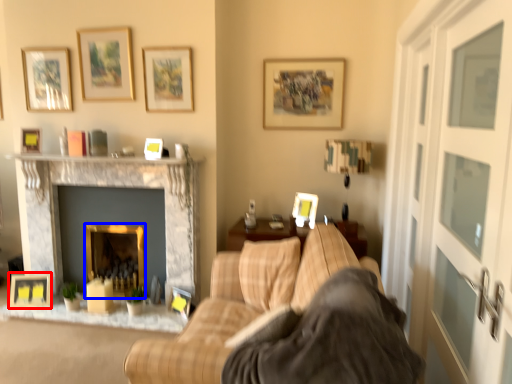
Question: Which object appears closest to the camera in this image, picture frame (highlighted by a red box) or fireplace (highlighted by a blue box)?

Choices:
 (A) picture frame
 (B) fireplace

Answer: (A)